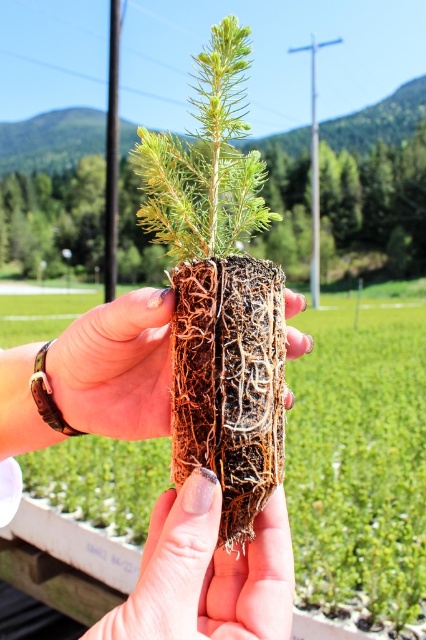
Question: Is brown textured plant at center positioned in front of brown textured roots at center?

Choices:
 (A) no
 (B) yes

Answer: (B)

Question: Where is green fibrous root ball at center located in relation to brown fibrous roots at center in the image?

Choices:
 (A) left
 (B) right

Answer: (B)

Question: Which object appears farthest from the camera in this image?

Choices:
 (A) brown textured soil at center
 (B) brown textured plant at center
 (C) brown textured roots at center
 (D) brown fibrous roots at center

Answer: (C)

Question: Estimate the real-world distances between objects in this image. Which object is farther from the green fibrous root ball at center?

Choices:
 (A) brown textured roots at center
 (B) brown fibrous roots at center

Answer: (B)

Question: Which of the following is the farthest from the observer?

Choices:
 (A) brown textured soil at center
 (B) brown fibrous roots at center
 (C) brown textured roots at center
 (D) brown textured plant at center

Answer: (C)

Question: Can you confirm if brown fibrous roots at center is smaller than brown textured soil at center?

Choices:
 (A) yes
 (B) no

Answer: (A)